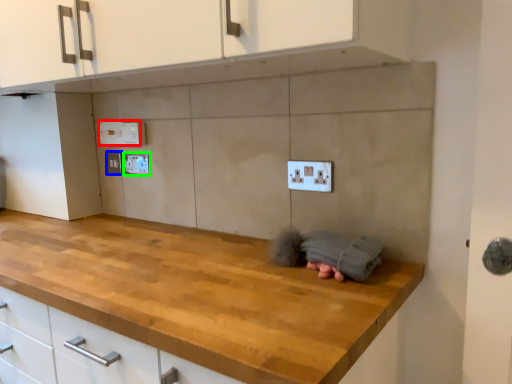
Question: Which object is the farthest from electric outlet (highlighted by a red box)? Choose among these: electric outlet (highlighted by a blue box) or electric outlet (highlighted by a green box).

Choices:
 (A) electric outlet
 (B) electric outlet

Answer: (A)